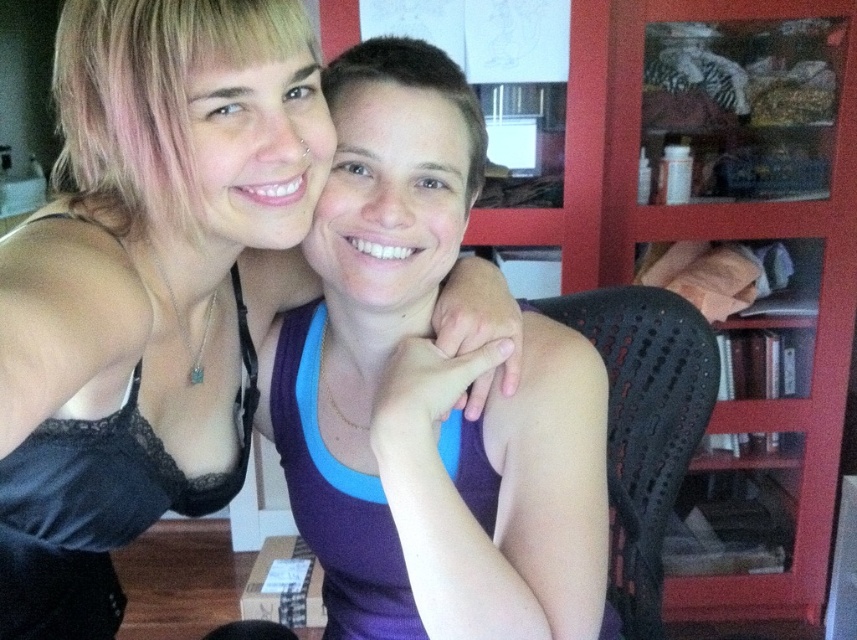
Question: Is black lace tank top at upper left above purple fabric tank top at center?

Choices:
 (A) no
 (B) yes

Answer: (B)

Question: Is black lace tank top at upper left in front of purple fabric tank top at center?

Choices:
 (A) yes
 (B) no

Answer: (A)

Question: Is black lace tank top at upper left smaller than purple fabric tank top at center?

Choices:
 (A) yes
 (B) no

Answer: (B)

Question: Which point appears farthest from the camera in this image?

Choices:
 (A) (106, 4)
 (B) (549, 324)

Answer: (B)